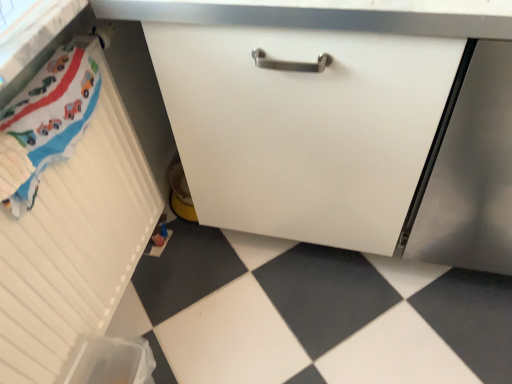
Question: Considering the relative positions of white matte radiator at left, the second cabinetry when ordered from right to left, and satin silver screen door at lower right in the image provided, is white matte radiator at left, the second cabinetry when ordered from right to left, behind satin silver screen door at lower right?

Choices:
 (A) yes
 (B) no

Answer: (B)

Question: From a real-world perspective, is white matte radiator at left, the second cabinetry when ordered from right to left, on top of satin silver screen door at lower right?

Choices:
 (A) no
 (B) yes

Answer: (A)

Question: Could you tell me if white matte radiator at left, the second cabinetry when ordered from right to left, is turned towards satin silver screen door at lower right?

Choices:
 (A) no
 (B) yes

Answer: (B)

Question: From a real-world perspective, is white matte radiator at left, the second cabinetry when ordered from right to left, under satin silver screen door at lower right?

Choices:
 (A) yes
 (B) no

Answer: (A)

Question: Are white matte radiator at left, which is the first cabinetry from left to right, and satin silver screen door at lower right far apart?

Choices:
 (A) no
 (B) yes

Answer: (A)

Question: From the image's perspective, is white matte cabinet at center, which ranks as the 1th cabinetry in right-to-left order, positioned above or below white matte radiator at left, the second cabinetry when ordered from right to left?

Choices:
 (A) below
 (B) above

Answer: (B)

Question: Is white matte cabinet at center, which appears as the 2th cabinetry when viewed from the left, spatially inside white matte radiator at left, which is the first cabinetry from left to right, or outside of it?

Choices:
 (A) inside
 (B) outside

Answer: (B)

Question: Based on their sizes in the image, would you say white matte cabinet at center, which appears as the 2th cabinetry when viewed from the left, is bigger or smaller than white matte radiator at left, the second cabinetry when ordered from right to left?

Choices:
 (A) big
 (B) small

Answer: (A)

Question: From a real-world perspective, is white matte cabinet at center, which appears as the 2th cabinetry when viewed from the left, positioned above or below white matte radiator at left, the second cabinetry when ordered from right to left?

Choices:
 (A) above
 (B) below

Answer: (A)

Question: Which is correct: white matte radiator at left, which is the first cabinetry from left to right, is inside white glossy tile at lower left, or outside of it?

Choices:
 (A) outside
 (B) inside

Answer: (A)

Question: In terms of width, does white matte radiator at left, the second cabinetry when ordered from right to left, look wider or thinner when compared to white glossy tile at lower left?

Choices:
 (A) thin
 (B) wide

Answer: (A)

Question: Considering the positions of white matte radiator at left, the second cabinetry when ordered from right to left, and white glossy tile at lower left in the image, is white matte radiator at left, the second cabinetry when ordered from right to left, bigger or smaller than white glossy tile at lower left?

Choices:
 (A) small
 (B) big

Answer: (A)

Question: In the image, is white matte radiator at left, the second cabinetry when ordered from right to left, positioned in front of or behind white glossy tile at lower left?

Choices:
 (A) behind
 (B) front

Answer: (B)

Question: Considering the positions of white glossy tile at lower left and white matte radiator at left, the second cabinetry when ordered from right to left, in the image, is white glossy tile at lower left bigger or smaller than white matte radiator at left, the second cabinetry when ordered from right to left,?

Choices:
 (A) small
 (B) big

Answer: (B)

Question: Is white glossy tile at lower left in front of or behind white matte radiator at left, the second cabinetry when ordered from right to left, in the image?

Choices:
 (A) front
 (B) behind

Answer: (B)